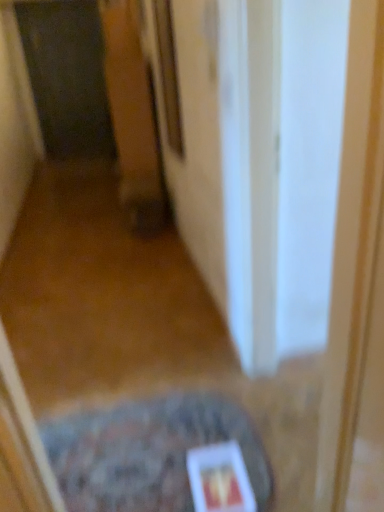
Where is `multicolored textured bath mat at lower center`? multicolored textured bath mat at lower center is located at coordinates (147, 452).

Describe the element at coordinates (147, 452) in the screenshot. I see `multicolored textured bath mat at lower center` at that location.

Where is `multicolored textured bath mat at lower center`? The image size is (384, 512). multicolored textured bath mat at lower center is located at coordinates (147, 452).